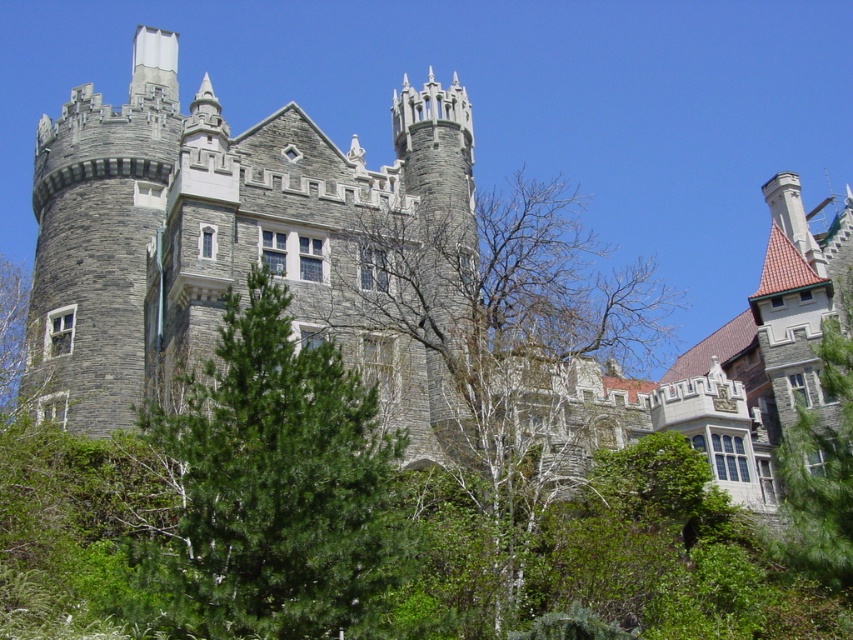
Between point (590, 292) and point (842, 371), which one is positioned behind?

The point (590, 292) is more distant.

Locate an element on the screen. The width and height of the screenshot is (853, 640). bare branches at center is located at coordinates (503, 342).

Image resolution: width=853 pixels, height=640 pixels. What are the coordinates of `bare branches at center` in the screenshot? It's located at [503, 342].

Is gray stone tower at center to the left of green needle-like tree at center from the viewer's perspective?

Indeed, gray stone tower at center is positioned on the left side of green needle-like tree at center.

Is gray stone tower at center further to the viewer compared to green needle-like tree at center?

Yes, it is.

Between point (140, 316) and point (323, 556), which one is positioned in front?

Point (323, 556)

This screenshot has height=640, width=853. I want to click on gray stone tower at center, so click(x=222, y=236).

Is green needle-like tree at center closer to camera compared to bare branches at center?

Yes, it is.

Between point (314, 566) and point (555, 188), which one is positioned in front?

Positioned in front is point (314, 566).

The width and height of the screenshot is (853, 640). I want to click on green needle-like tree at center, so click(276, 486).